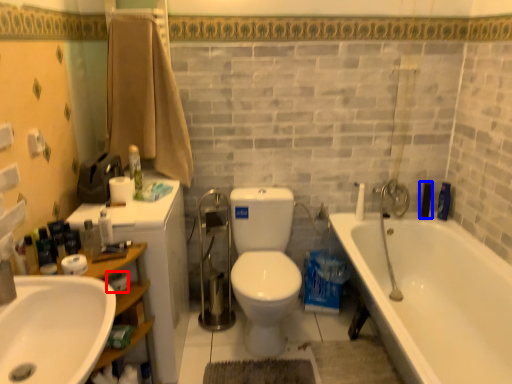
Question: Which of the following is the closest to the observer, toilet paper (highlighted by a red box) or toiletry (highlighted by a blue box)?

Choices:
 (A) toilet paper
 (B) toiletry

Answer: (A)